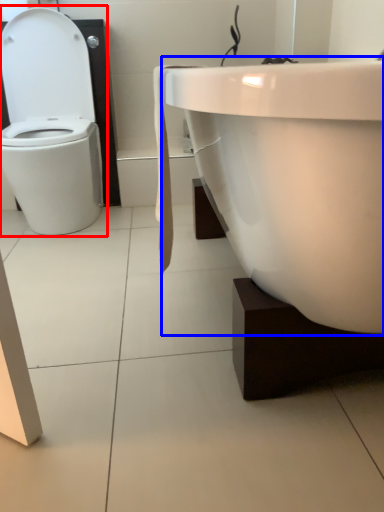
Question: Which of the following is the closest to the observer, toilet (highlighted by a red box) or sink (highlighted by a blue box)?

Choices:
 (A) toilet
 (B) sink

Answer: (B)